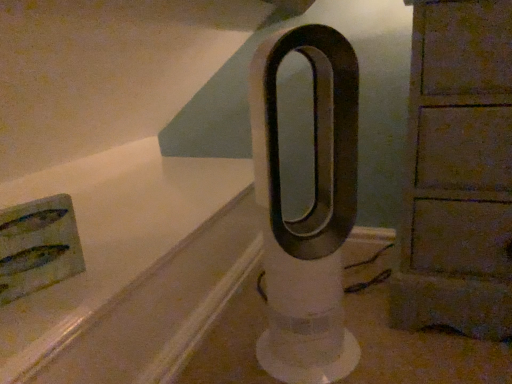
Question: Can you confirm if white plastic fan at center is wider than wooden cabinet at right?

Choices:
 (A) no
 (B) yes

Answer: (A)

Question: Is white plastic fan at center positioned beyond the bounds of wooden cabinet at right?

Choices:
 (A) yes
 (B) no

Answer: (A)

Question: Is white plastic fan at center to the right of wooden cabinet at right from the viewer's perspective?

Choices:
 (A) no
 (B) yes

Answer: (A)

Question: Is white plastic fan at center oriented towards wooden cabinet at right?

Choices:
 (A) no
 (B) yes

Answer: (A)

Question: Is white plastic fan at center bigger than wooden cabinet at right?

Choices:
 (A) no
 (B) yes

Answer: (A)

Question: Is white plastic fan at center turned away from wooden cabinet at right?

Choices:
 (A) no
 (B) yes

Answer: (A)

Question: Is wooden cabinet at right shorter than white plastic fan at center?

Choices:
 (A) no
 (B) yes

Answer: (A)

Question: Does wooden cabinet at right have a greater width compared to white plastic fan at center?

Choices:
 (A) no
 (B) yes

Answer: (B)

Question: Does wooden cabinet at right appear on the right side of white plastic fan at center?

Choices:
 (A) yes
 (B) no

Answer: (A)

Question: Is white plastic fan at center inside wooden cabinet at right?

Choices:
 (A) yes
 (B) no

Answer: (B)

Question: Is the position of wooden cabinet at right less distant than that of white plastic fan at center?

Choices:
 (A) no
 (B) yes

Answer: (A)

Question: Is wooden cabinet at right at the left side of white plastic fan at center?

Choices:
 (A) yes
 (B) no

Answer: (B)

Question: From the image's perspective, is wooden cabinet at right positioned above or below white plastic fan at center?

Choices:
 (A) below
 (B) above

Answer: (B)